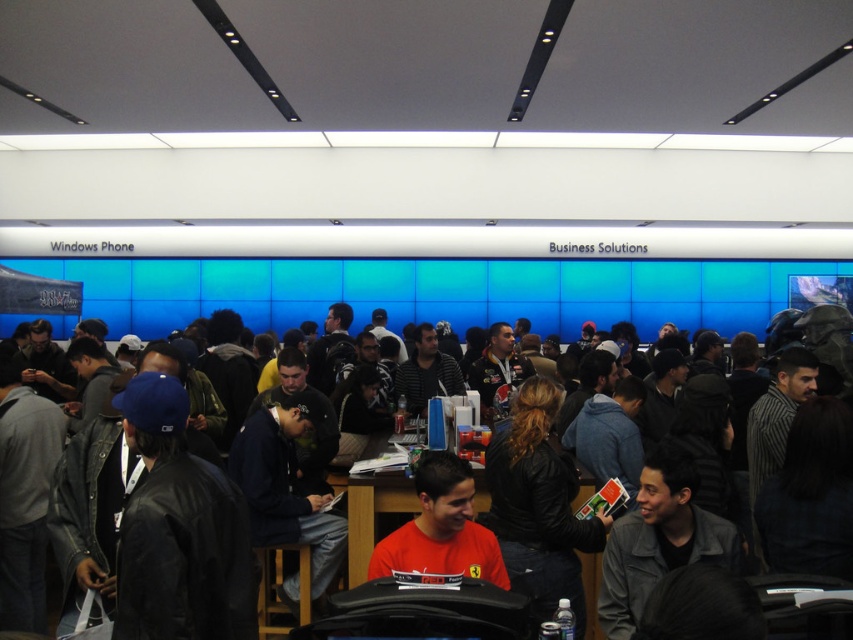
Which is above, matte red shirt at center or red shirt at center?

matte red shirt at center

Who is more distant from viewer, (456, 552) or (479, 476)?

The point (479, 476) is more distant.

The width and height of the screenshot is (853, 640). In order to click on matte red shirt at center in this screenshot , I will do `click(440, 528)`.